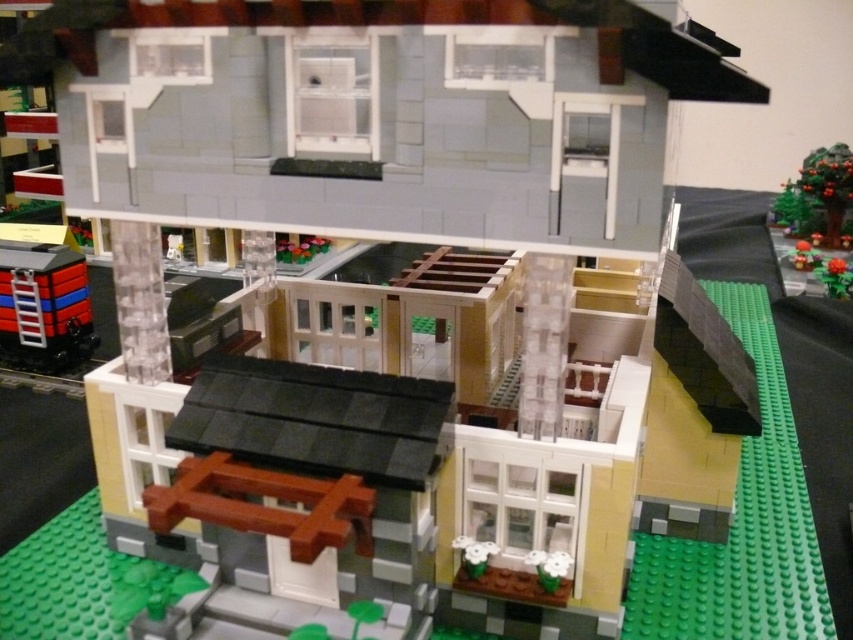
You are a Lego train engineer who wants to place a new train on the green baseplate. The existing train is at point [44,307]. Can you safely place your new train on the green baseplate without overlapping the existing train?

The existing train at point [44,307] is a matte black train, so you can safely place your new train on the green baseplate as long as it does not overlap the coordinates of the existing train at point [44,307].

You are a Lego figure standing on the green baseplate. You want to walk to the green matte tree at upper right but there is a matte black train at left blocking your path. Can you reach the tree without going around the train?

The matte black train at left is in front of the green matte tree at upper right, so you cannot reach the tree without going around the train.